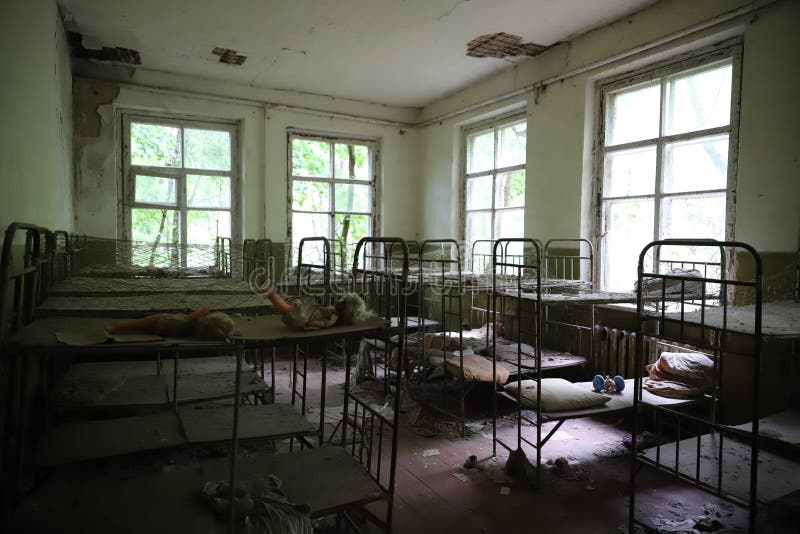
Where is `window  frame`? The image size is (800, 534). window  frame is located at coordinates (598, 127), (473, 125), (290, 177), (236, 180).